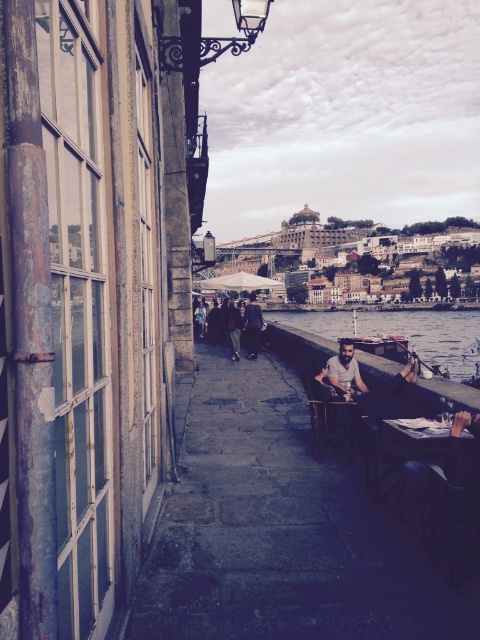
Does dark wood table at lower right have a lesser width compared to dark brown leather jacket at center?

No.

Who is more forward, (418, 435) or (249, 301)?

Positioned in front is point (418, 435).

Between point (420, 428) and point (252, 342), which one is positioned in front?

Point (420, 428)

Identify the location of dark wood table at lower right. The image size is (480, 640). (435, 456).

Consider the image. Is clear water at dock center positioned behind light brown wooden chair at center?

Yes, clear water at dock center is further from the viewer.

Which is behind, point (350, 314) or point (334, 362)?

The point (350, 314) is more distant.

The width and height of the screenshot is (480, 640). What are the coordinates of `clear water at dock center` in the screenshot? It's located at (431, 336).

How much distance is there between clear water at dock center and dark gray fabric jacket at center?

A distance of 38.52 meters exists between clear water at dock center and dark gray fabric jacket at center.

Between clear water at dock center and dark gray fabric jacket at center, which one is positioned lower?

clear water at dock center is below.

Is point (295, 317) more distant than point (231, 344)?

That is True.

Find the location of `clear water at dock center`. clear water at dock center is located at coordinates (431, 336).